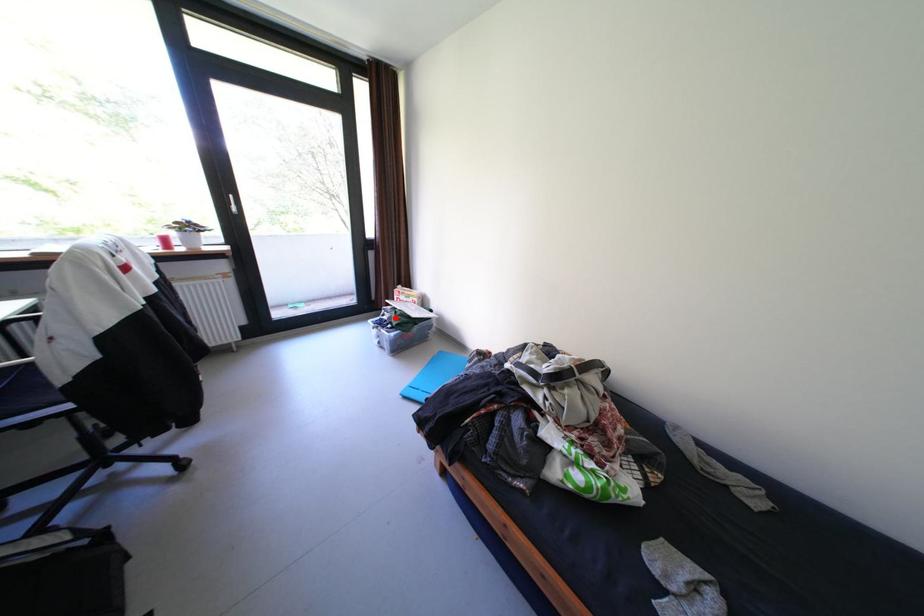
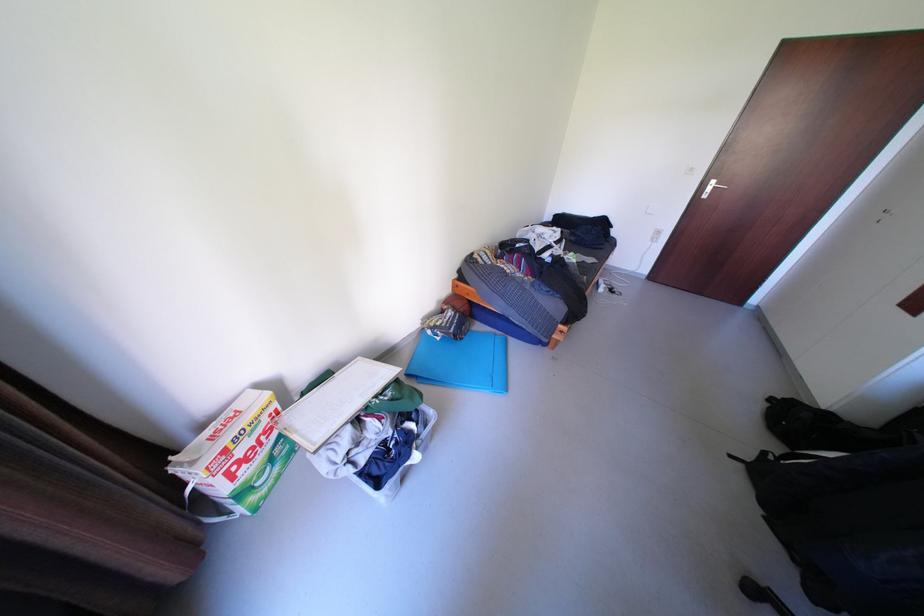
Question: I am providing you with two images of the same scene from different viewpoints. In image1, a red point is highlighted. Considering the same 3D point in image2, which of the following is correct?

Choices:
 (A) It is closer
 (B) It is farther

Answer: (A)